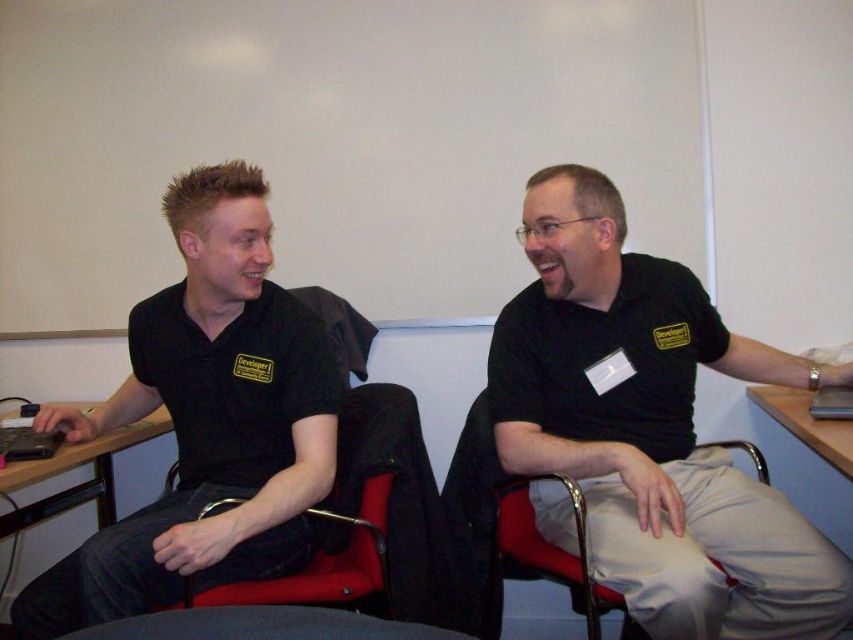
You are standing in the conference room and want to place a small plant between the two points labeled point (666,483) and point (10,486). Which point should the plant be closer to if it needs to be placed closer to the front of the room?

The plant should be closer to point (666,483) because it is in front of point (10,486) according to the spatial relationship between the two points.

You are organizing a photo shoot for a clothing brand and need to ensure that the black matte shirt at center will fit on the wooden desk at left. Based on the scene description, can you confirm if the shirt will fit on the desk?

The black matte shirt at center has a width larger than the wooden desk at left, so the shirt will not fit on the desk.

You are sitting in the gray fabric chair at lower center and want to move to the red fabric chair at center. Which direction should you move to reach it?

The red fabric chair at center is to the right of the gray fabric chair at lower center, so you should move to the right to reach it.